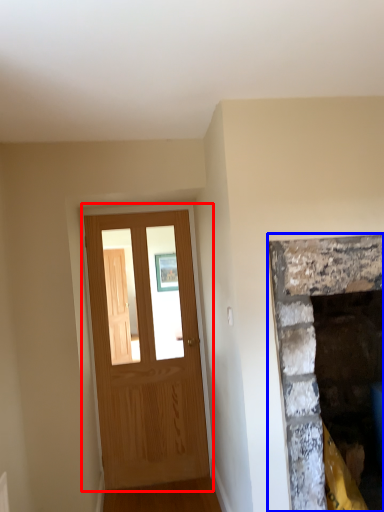
Question: Among these objects, which one is nearest to the camera, barn door (highlighted by a red box) or fireplace (highlighted by a blue box)?

Choices:
 (A) barn door
 (B) fireplace

Answer: (B)